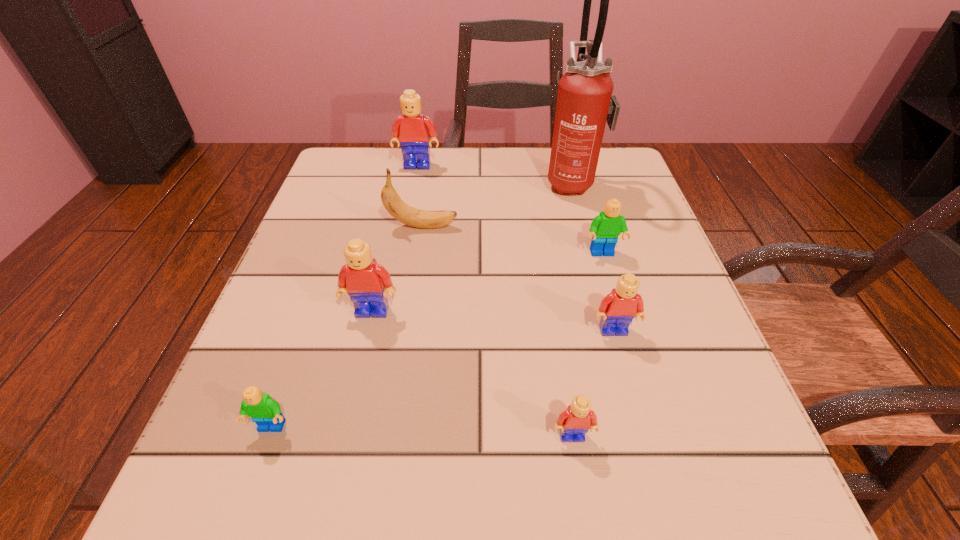
This screenshot has height=540, width=960. I want to click on blank area at the far edge, so click(547, 185).

The width and height of the screenshot is (960, 540). In the image, there is a desktop. Identify the location of blank space at the near edge. (359, 517).

Locate an element on the screen. This screenshot has width=960, height=540. blank space at the left edge of the desktop is located at coordinates (332, 322).

The height and width of the screenshot is (540, 960). Identify the location of free location at the right edge. (668, 321).

This screenshot has height=540, width=960. I want to click on vacant space at the far left corner of the desktop, so click(348, 185).

In the image, there is a desktop. Identify the location of free space at the near left corner. Image resolution: width=960 pixels, height=540 pixels. tap(205, 512).

The image size is (960, 540). In the image, there is a desktop. What are the coordinates of `vacant space at the far right corner` in the screenshot? It's located at (604, 146).

Where is `free space that is in between the tallest Lego and the banana`? The width and height of the screenshot is (960, 540). free space that is in between the tallest Lego and the banana is located at coordinates (420, 196).

In order to click on vacant area between the third farthest object and the biggest yellow Lego in this screenshot , I will do `click(420, 196)`.

Find the location of a particular element. The width and height of the screenshot is (960, 540). vacant area that lies between the third farthest object and the fifth farthest object is located at coordinates (397, 268).